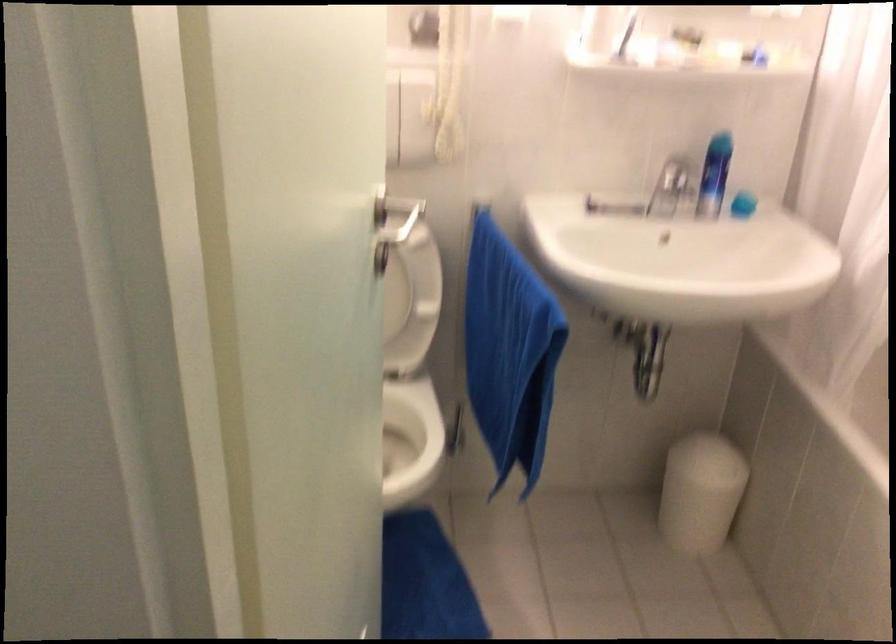
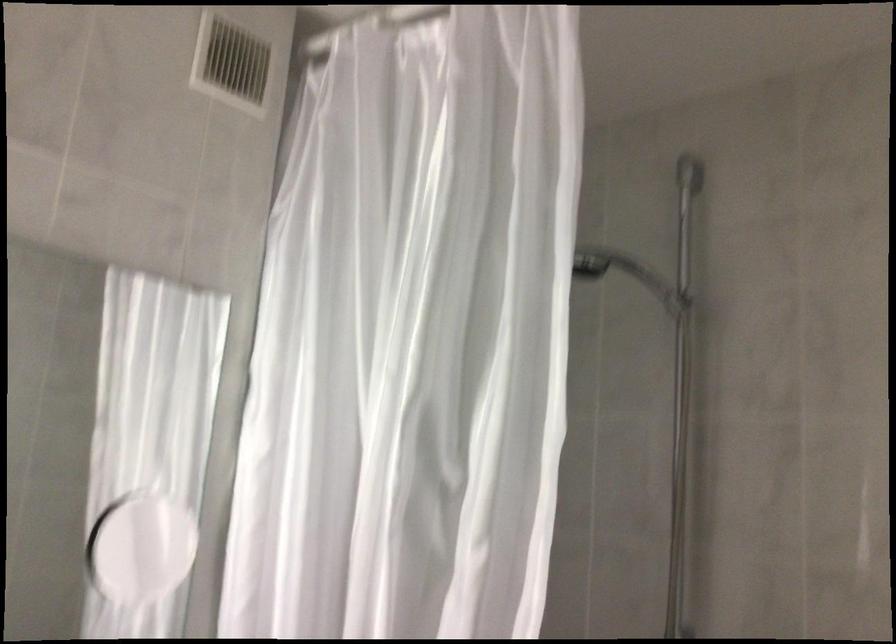
The images are taken continuously from a first-person perspective. In which direction is your viewpoint rotating?

The rotation direction of the camera is right-up.